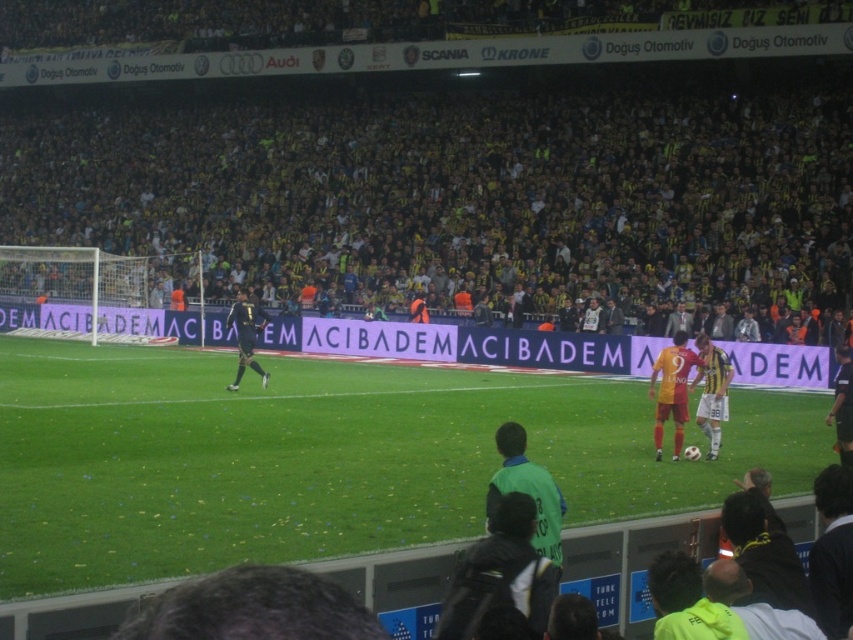
You are a drone operator controlling a drone that needs to fly from the point at coordinates point (35, 163) to the point at coordinates point (445, 612). Considering the soccer match scene, will the drone have to ascend or descend to move from the first point to the second?

The point (35, 163) is further to the viewer than point (445, 612), so the drone will need to descend to move from the first point to the second point.

You are a soccer player standing on the field. You need to kick the ball from the green grass at center to the dark green jersey at lower center. Which direction should you kick the ball?

You should kick the ball towards the lower center direction since the dark green jersey at lower center is located in that area.

You are a soccer player standing on the field. You see the green grass at center and the dark green jersey at lower center. Which object is higher up in the image?

The green grass at center is above the dark green jersey at lower center, so it is higher up in the image.